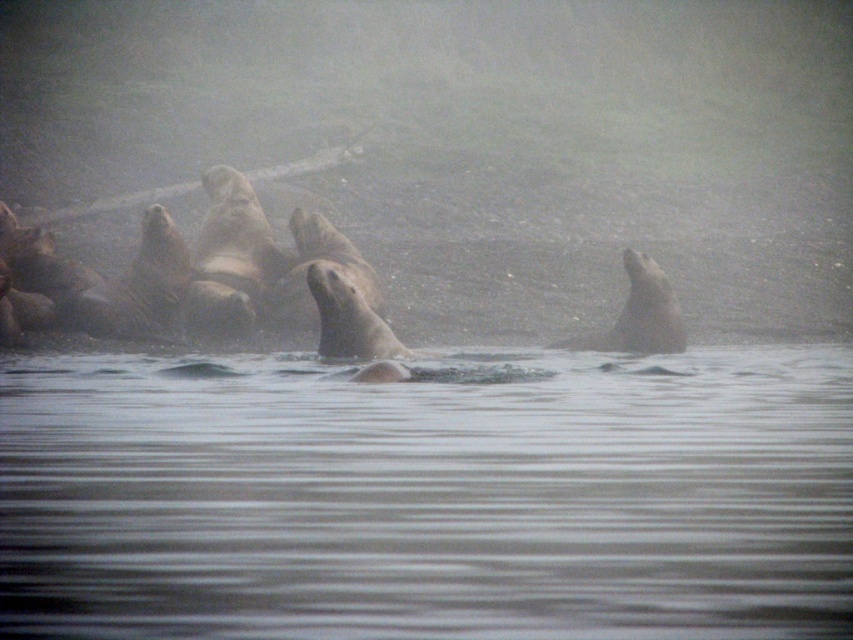
Between gray fur seal at center and brown fur seal at center, which one is positioned higher?

gray fur seal at center is higher up.

Is gray fur seal at center to the right of brown fur seal at center from the viewer's perspective?

In fact, gray fur seal at center is to the left of brown fur seal at center.

Does point (289, 321) lie in front of point (357, 321)?

No, it is behind (357, 321).

Find the location of a particular element. The width and height of the screenshot is (853, 640). gray fur seal at center is located at coordinates (320, 266).

Does gray fur seal at center have a smaller size compared to smooth gray seal at right?

Correct, gray fur seal at center occupies less space than smooth gray seal at right.

Which is more to the left, gray fur seal at center or smooth gray seal at right?

gray fur seal at center is more to the left.

Locate an element on the screen. This screenshot has height=640, width=853. gray fur seal at center is located at coordinates (320, 266).

Is smooth gray seal at right bigger than brown fur seal at center?

Yes.

This screenshot has height=640, width=853. What do you see at coordinates (639, 314) in the screenshot? I see `smooth gray seal at right` at bounding box center [639, 314].

Which is in front, point (668, 323) or point (387, 346)?

Positioned in front is point (387, 346).

The height and width of the screenshot is (640, 853). Identify the location of smooth gray seal at right. (639, 314).